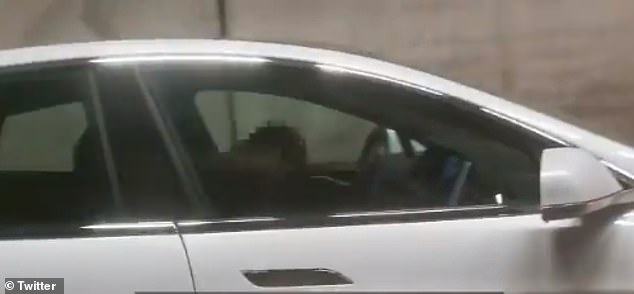
At what (x,y) coordinates should I click in order to perform the action: click on background wall. Please return your answer as a coordinate pair (x, y). Looking at the image, I should click on (480, 42), (56, 21).